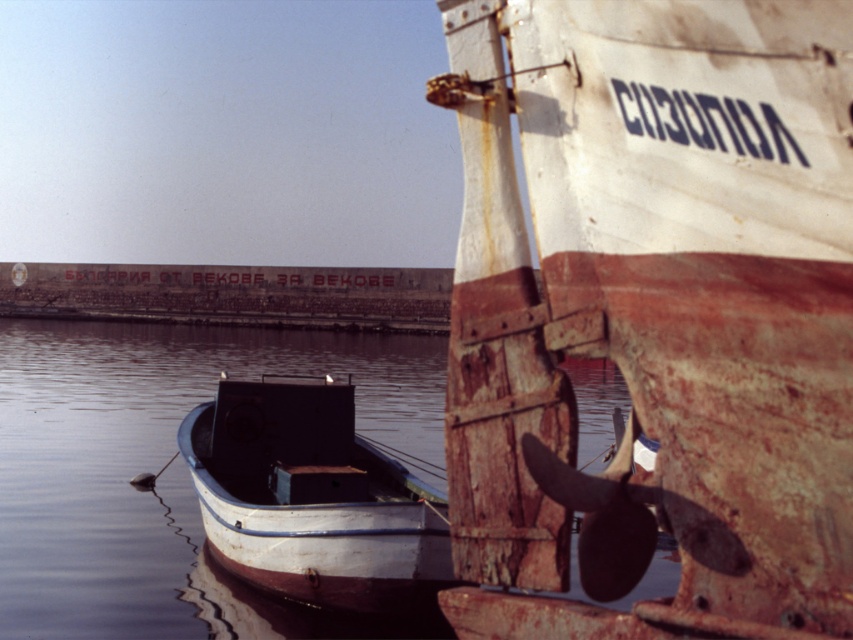
Question: Based on their relative distances, which object is nearer to the rusty metal boat at center?

Choices:
 (A) smooth water at center
 (B) rusty wood boat at center

Answer: (B)

Question: Which of the following is the closest to the observer?

Choices:
 (A) rusty metal boat at center
 (B) smooth water at center
 (C) rusty wood boat at center

Answer: (C)

Question: Does rusty wood boat at center come behind smooth water at center?

Choices:
 (A) yes
 (B) no

Answer: (B)

Question: Which object is closer to the camera taking this photo?

Choices:
 (A) rusty wood boat at center
 (B) rusty metal boat at center
 (C) smooth water at center

Answer: (A)

Question: Is rusty wood boat at center above smooth water at center?

Choices:
 (A) no
 (B) yes

Answer: (A)

Question: Does rusty wood boat at center have a larger size compared to smooth water at center?

Choices:
 (A) no
 (B) yes

Answer: (A)